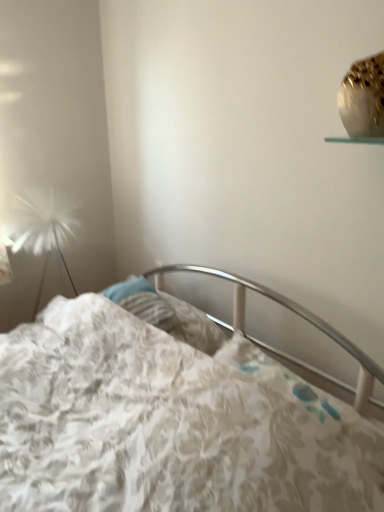
Question: Considering the relative sizes of white fluffy lamp at left and floral fabric bed at center in the image provided, is white fluffy lamp at left thinner than floral fabric bed at center?

Choices:
 (A) no
 (B) yes

Answer: (B)

Question: Is white fluffy lamp at left in contact with floral fabric bed at center?

Choices:
 (A) no
 (B) yes

Answer: (A)

Question: Considering the relative sizes of white fluffy lamp at left and floral fabric bed at center in the image provided, is white fluffy lamp at left shorter than floral fabric bed at center?

Choices:
 (A) yes
 (B) no

Answer: (A)

Question: From the image's perspective, would you say white fluffy lamp at left is positioned over floral fabric bed at center?

Choices:
 (A) no
 (B) yes

Answer: (B)

Question: Is floral fabric bed at center completely or partially inside white fluffy lamp at left?

Choices:
 (A) yes
 (B) no

Answer: (B)

Question: Is white fluffy lamp at left wider than floral fabric bed at center?

Choices:
 (A) yes
 (B) no

Answer: (B)

Question: From the image's perspective, is floral fabric bed at center on top of white fluffy lamp at left?

Choices:
 (A) no
 (B) yes

Answer: (A)

Question: Can you confirm if floral fabric bed at center is shorter than white fluffy lamp at left?

Choices:
 (A) yes
 (B) no

Answer: (B)

Question: Does floral fabric bed at center contain white fluffy lamp at left?

Choices:
 (A) yes
 (B) no

Answer: (B)

Question: Could you tell me if floral fabric bed at center is turned towards white fluffy lamp at left?

Choices:
 (A) no
 (B) yes

Answer: (A)

Question: Does floral fabric bed at center lie behind white fluffy lamp at left?

Choices:
 (A) yes
 (B) no

Answer: (B)

Question: Is floral fabric bed at center next to white fluffy lamp at left and touching it?

Choices:
 (A) yes
 (B) no

Answer: (B)

Question: Based on their sizes in the image, would you say white fluffy lamp at left is bigger or smaller than floral fabric bed at center?

Choices:
 (A) big
 (B) small

Answer: (B)